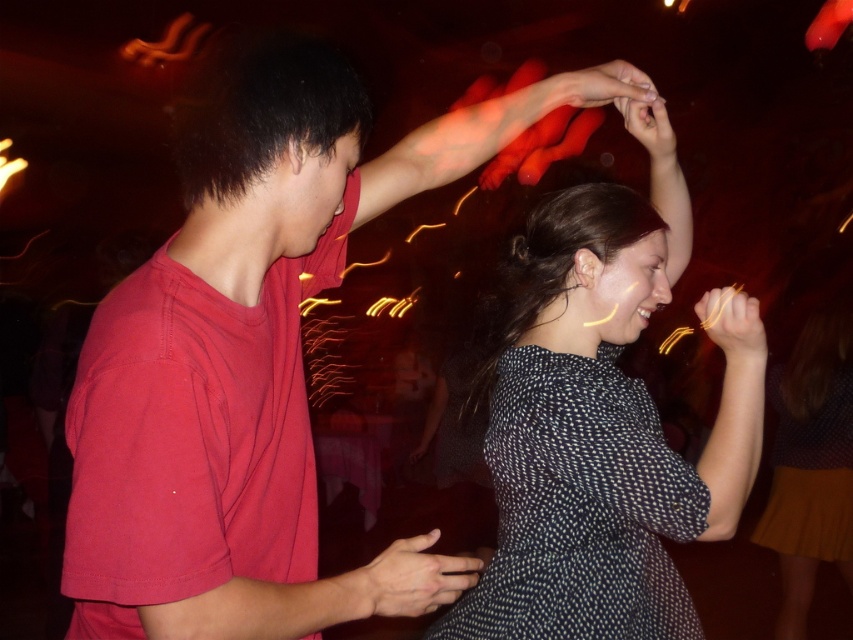
Question: Based on their relative distances, which object is farther from the matte red t-shirt at left?

Choices:
 (A) matte black phone at center
 (B) dark blue dotted dress at center

Answer: (B)

Question: Is the position of matte red t-shirt at left more distant than that of matte black phone at center?

Choices:
 (A) yes
 (B) no

Answer: (B)

Question: Which object is the closest to the spotted fabric dress at center?

Choices:
 (A) smooth gold bracelet at upper right
 (B) dark blue dotted dress at center
 (C) matte black phone at center

Answer: (B)

Question: Is matte red t-shirt at left wider than smooth gold bracelet at upper right?

Choices:
 (A) no
 (B) yes

Answer: (B)

Question: Is matte red t-shirt at left behind spotted fabric dress at center?

Choices:
 (A) yes
 (B) no

Answer: (B)

Question: Based on their relative distances, which object is nearer to the matte black phone at center?

Choices:
 (A) smooth gold bracelet at upper right
 (B) matte red t-shirt at left

Answer: (B)